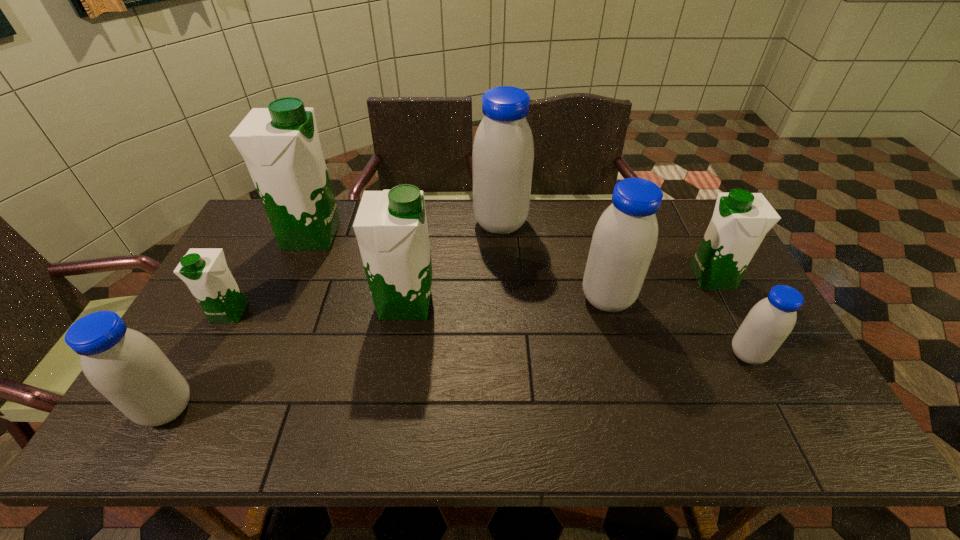
Image resolution: width=960 pixels, height=540 pixels. In order to click on object that stands as the sixth closest to the nearest soya milk in this screenshot , I will do `click(770, 321)`.

Where is `object that is the closest to the third biggest green soya milk`? The height and width of the screenshot is (540, 960). object that is the closest to the third biggest green soya milk is located at coordinates (770, 321).

At what (x,y) coordinates should I click in order to perform the action: click on soya milk that stands as the closest to the fifth object from right to left. Please return your answer as a coordinate pair (x, y). The image size is (960, 540). Looking at the image, I should click on (280, 145).

Identify the location of soya milk that is the fourth closest to the nearest soya milk. (503, 150).

Where is `green soya milk object that ranks as the third closest to the fourth object from left to right`? green soya milk object that ranks as the third closest to the fourth object from left to right is located at coordinates (741, 219).

Select which green soya milk is the second closest to the third blue soya milk from left to right. Please provide its 2D coordinates. Your answer should be formatted as a tuple, i.e. [(x, y)], where the tuple contains the x and y coordinates of a point satisfying the conditions above.

[(391, 228)]

Identify which blue soya milk is the second nearest to the smallest green soya milk. Please provide its 2D coordinates. Your answer should be formatted as a tuple, i.e. [(x, y)], where the tuple contains the x and y coordinates of a point satisfying the conditions above.

[(503, 150)]

Point out which blue soya milk is positioned as the second nearest to the rightmost green soya milk. Please provide its 2D coordinates. Your answer should be formatted as a tuple, i.e. [(x, y)], where the tuple contains the x and y coordinates of a point satisfying the conditions above.

[(624, 240)]

Locate an element on the screen. free space in the image that satisfies the following two spatial constraints: 1. on the back side of the leftmost blue soya milk; 2. on the right side of the second blue soya milk from right to left is located at coordinates (228, 299).

Where is `free space that satisfies the following two spatial constraints: 1. on the front-facing side of the second green soya milk from right to left; 2. on the right side of the second nearest blue soya milk`? Image resolution: width=960 pixels, height=540 pixels. free space that satisfies the following two spatial constraints: 1. on the front-facing side of the second green soya milk from right to left; 2. on the right side of the second nearest blue soya milk is located at coordinates (397, 354).